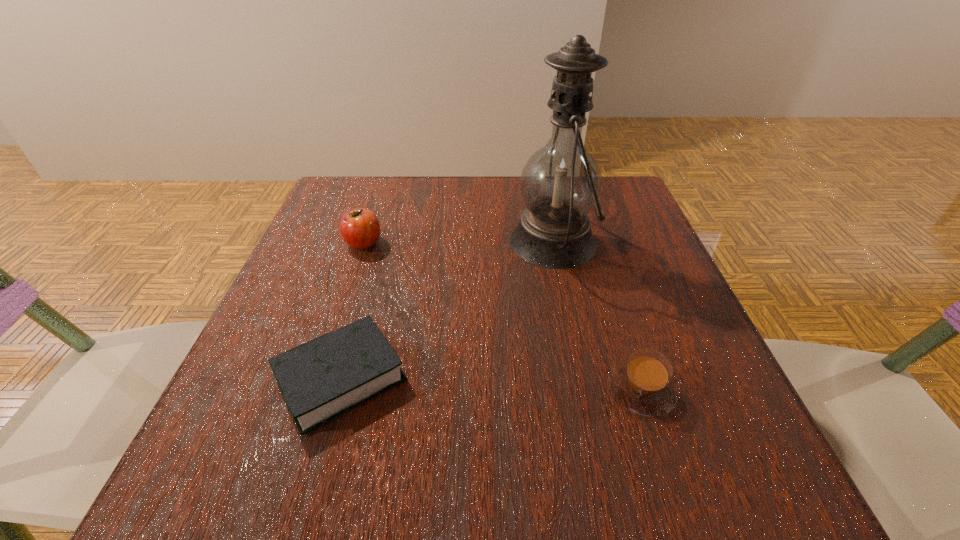
I want to click on the tallest object, so click(560, 183).

Find the location of a particular element. This screenshot has width=960, height=540. apple is located at coordinates (360, 229).

At what (x,y) coordinates should I click in order to perform the action: click on cappuccino. Please return your answer as a coordinate pair (x, y). Looking at the image, I should click on (643, 384).

This screenshot has width=960, height=540. I want to click on Bible, so click(x=330, y=375).

Where is `free point located 0.210m on the front of the tallest object`? free point located 0.210m on the front of the tallest object is located at coordinates (580, 370).

Where is `free spot located 0.070m on the right of the apple`? free spot located 0.070m on the right of the apple is located at coordinates [416, 243].

You are a GUI agent. You are given a task and a screenshot of the screen. Output one action in this format:
    pyautogui.click(x=<x>, y=<y>)
    Task: Click on the blank space located 0.090m on the front of the cappuccino
    Image resolution: width=960 pixels, height=540 pixels.
    Given the screenshot: What is the action you would take?
    pyautogui.click(x=672, y=483)

Image resolution: width=960 pixels, height=540 pixels. Identify the location of vacant space located on the right of the Bible. (441, 378).

At what (x,y) coordinates should I click in order to perform the action: click on object present at the far edge. Please return your answer as a coordinate pair (x, y). Looking at the image, I should click on (560, 183).

Where is `apple that is at the left edge`? Image resolution: width=960 pixels, height=540 pixels. apple that is at the left edge is located at coordinates (360, 229).